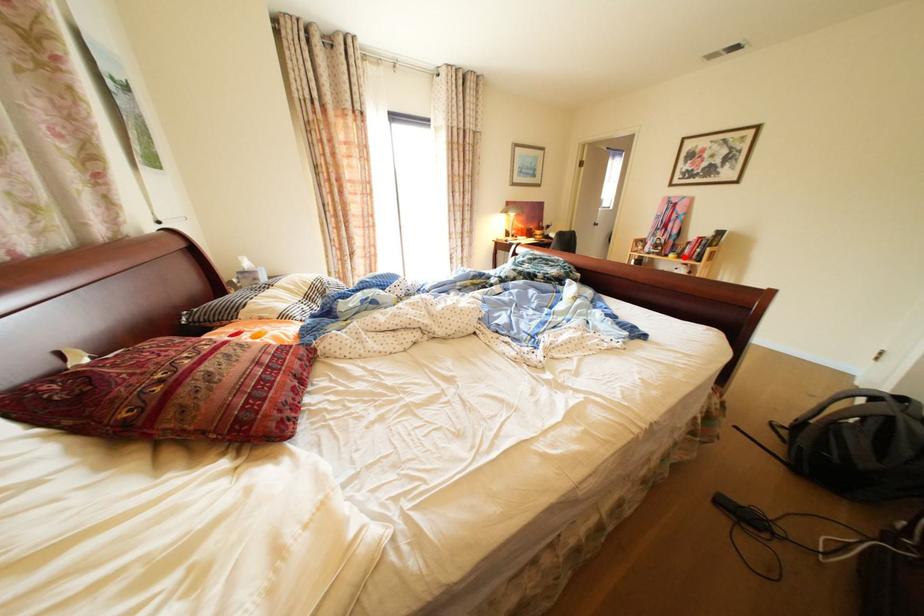
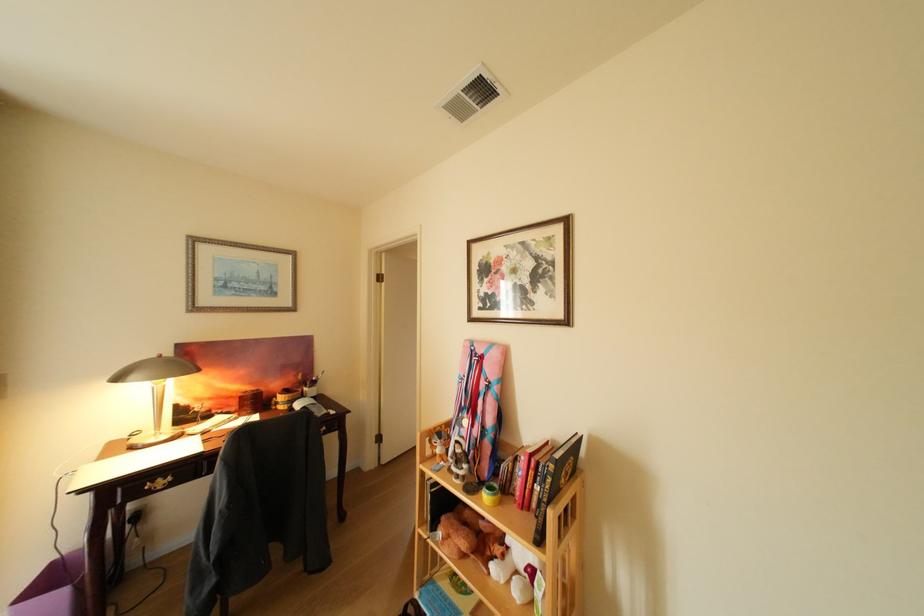
Question: I am providing you with two images of the same scene from different viewpoints. In image1, a red point is highlighted. Considering the same 3D point in image2, which of the following is correct?

Choices:
 (A) It is closer
 (B) It is farther

Answer: (B)